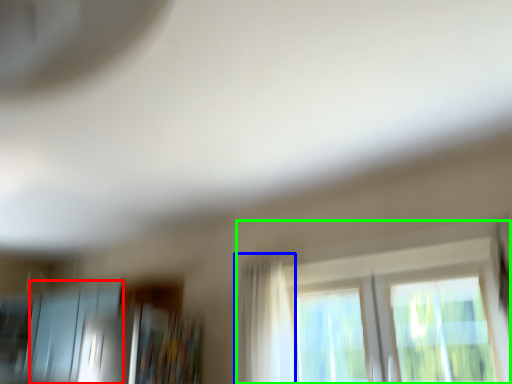
Question: Which is nearer to the screen door (highlighted by a red box)? curtain (highlighted by a blue box) or window (highlighted by a green box).

Choices:
 (A) curtain
 (B) window

Answer: (A)